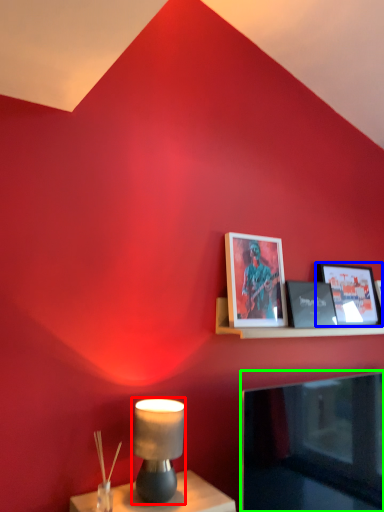
Question: Considering the real-world distances, which object is closest to table lamp (highlighted by a red box)? picture frame (highlighted by a blue box) or television (highlighted by a green box).

Choices:
 (A) picture frame
 (B) television

Answer: (B)